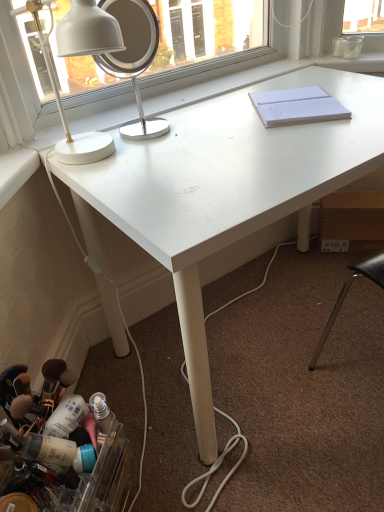
Identify the location of blank space situated above white smooth window sill at upper right (from a real-world perspective). (347, 56).